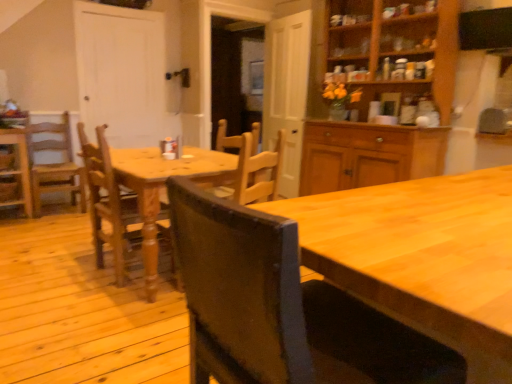
Where is `vacant area that lies to the right of wooden chair at left, which is the first chair in left-to-right order`? The image size is (512, 384). vacant area that lies to the right of wooden chair at left, which is the first chair in left-to-right order is located at coordinates (50, 222).